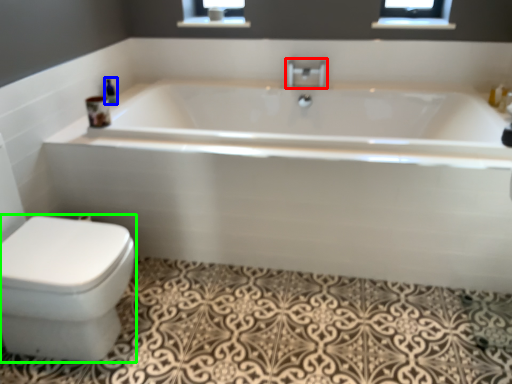
Question: Which is farther away from tap (highlighted by a red box)? toiletry (highlighted by a blue box) or bidet (highlighted by a green box)?

Choices:
 (A) toiletry
 (B) bidet

Answer: (B)